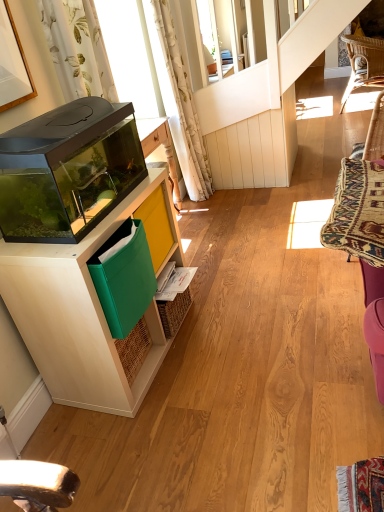
What do you see at coordinates (68, 170) in the screenshot?
I see `transparent glass aquarium at left` at bounding box center [68, 170].

What is the approximate height of white floral fabric curtain at upper center, the 1th curtain viewed from the back?

white floral fabric curtain at upper center, the 1th curtain viewed from the back, is 4.78 feet in height.

At what (x,y) coordinates should I click in order to perform the action: click on green fabric folder at lower left. Please return your answer as a coordinate pair (x, y). The width and height of the screenshot is (384, 512). Looking at the image, I should click on (156, 225).

Image resolution: width=384 pixels, height=512 pixels. Find the location of `white floral fabric curtain at upper left, placed as the 2th curtain when sorted from right to left`. white floral fabric curtain at upper left, placed as the 2th curtain when sorted from right to left is located at coordinates (72, 47).

Identify the location of cabinetry on the right of white floral fabric curtain at upper left, placed as the 2th curtain when sorted from right to left. This screenshot has width=384, height=512. (84, 310).

Considering the relative sizes of white wood cabinet at left and white floral fabric curtain at upper left, which is counted as the 2th curtain, starting from the back, in the image provided, is white wood cabinet at left smaller than white floral fabric curtain at upper left, which is counted as the 2th curtain, starting from the back,?

No, white wood cabinet at left is not smaller than white floral fabric curtain at upper left, which is counted as the 2th curtain, starting from the back.

Which point is more distant from viewer, (36, 360) or (160, 21)?

Point (160, 21)

In the scene shown: Considering the relative positions of woven wicker swivel chair at right and woven rattan chair at upper right in the image provided, is woven wicker swivel chair at right to the left of woven rattan chair at upper right from the viewer's perspective?

Yes.

Is woven wicker swivel chair at right oriented towards woven rattan chair at upper right?

Yes, woven wicker swivel chair at right is aimed at woven rattan chair at upper right.

Which object is further away from the camera, woven wicker swivel chair at right or woven rattan chair at upper right?

woven rattan chair at upper right is more distant.

From the image's perspective, is woven wicker swivel chair at right positioned above or below woven rattan chair at upper right?

woven wicker swivel chair at right is below woven rattan chair at upper right.

Considering the positions of objects woven rattan chair at upper right and woven wicker swivel chair at right in the image provided, who is more to the left, woven rattan chair at upper right or woven wicker swivel chair at right?

Positioned to the left is woven wicker swivel chair at right.

Between woven rattan chair at upper right and woven wicker swivel chair at right, which one has larger width?

woven wicker swivel chair at right.

In the scene shown: From a real-world perspective, is woven rattan chair at upper right positioned over woven wicker swivel chair at right based on gravity?

No, from a real-world perspective, woven rattan chair at upper right is not on top of woven wicker swivel chair at right.

Is white floral fabric curtain at upper left, which is the 1th curtain in front-to-back order, positioned beyond the bounds of woven wicker swivel chair at right?

white floral fabric curtain at upper left, which is the 1th curtain in front-to-back order, is positioned outside woven wicker swivel chair at right.

Which is behind, white floral fabric curtain at upper left, arranged as the 1th curtain when viewed from the left, or woven wicker swivel chair at right?

woven wicker swivel chair at right is further from the camera.

Considering the points (67, 6) and (341, 178), which point is in front, point (67, 6) or point (341, 178)?

The point (341, 178) is more forward.

Based on the photo, who is bigger, white floral fabric curtain at upper left, arranged as the 1th curtain when viewed from the left, or woven wicker swivel chair at right?

With larger size is woven wicker swivel chair at right.

Is transparent glass aquarium at left far away from woven rattan chair at upper right?

Yes, transparent glass aquarium at left and woven rattan chair at upper right are quite far apart.

Is point (95, 206) closer or farther from the camera than point (378, 81)?

Clearly, point (95, 206) is closer to the camera than point (378, 81).

Considering the sizes of transparent glass aquarium at left and woven rattan chair at upper right in the image, is transparent glass aquarium at left wider or thinner than woven rattan chair at upper right?

Considering their sizes, transparent glass aquarium at left looks slimmer than woven rattan chair at upper right.

How different are the orientations of green fabric folder at lower left and white floral fabric curtain at upper left, which is the 1th curtain in front-to-back order, in degrees?

2.95 degrees separate the facing orientations of green fabric folder at lower left and white floral fabric curtain at upper left, which is the 1th curtain in front-to-back order.

Does green fabric folder at lower left have a smaller size compared to white floral fabric curtain at upper left, which is the 1th curtain in front-to-back order?

Indeed, green fabric folder at lower left has a smaller size compared to white floral fabric curtain at upper left, which is the 1th curtain in front-to-back order.

Locate an element on the screen. shelf below the white floral fabric curtain at upper left, placed as the 2th curtain when sorted from right to left (from a real-world perspective) is located at coordinates (156, 225).

From the image's perspective, does green fabric folder at lower left appear higher than white floral fabric curtain at upper left, which is counted as the 2th curtain, starting from the back?

Actually, green fabric folder at lower left appears below white floral fabric curtain at upper left, which is counted as the 2th curtain, starting from the back, in the image.

Considering the sizes of objects green fabric folder at lower left and white floral fabric curtain at upper center, arranged as the second curtain when viewed from the left, in the image provided, who is shorter, green fabric folder at lower left or white floral fabric curtain at upper center, arranged as the second curtain when viewed from the left,?

green fabric folder at lower left is shorter.

Is green fabric folder at lower left thinner than white floral fabric curtain at upper center, arranged as the second curtain when viewed from the left?

Correct, the width of green fabric folder at lower left is less than that of white floral fabric curtain at upper center, arranged as the second curtain when viewed from the left.

How different are the orientations of green fabric folder at lower left and white floral fabric curtain at upper center, the 2th curtain in the front-to-back sequence, in degrees?

There is a 2.95-degree angle between the facing directions of green fabric folder at lower left and white floral fabric curtain at upper center, the 2th curtain in the front-to-back sequence.

This screenshot has width=384, height=512. Find the location of `cabinetry in front of the white floral fabric curtain at upper left, which is the 1th curtain in front-to-back order`. cabinetry in front of the white floral fabric curtain at upper left, which is the 1th curtain in front-to-back order is located at coordinates (84, 310).

Locate an element on the screen. This screenshot has width=384, height=512. chair above the woven wicker swivel chair at right (from the image's perspective) is located at coordinates (364, 63).

Based on the photo, from the image, which object appears to be nearer to green fabric folder at lower left, woven rattan chair at upper right or white floral fabric curtain at upper left, which is the 1th curtain in front-to-back order?

The object closer to green fabric folder at lower left is white floral fabric curtain at upper left, which is the 1th curtain in front-to-back order.

From the image, which object appears to be farther from green fabric folder at lower left, white floral fabric curtain at upper left, which is the 1th curtain in front-to-back order, or woven rattan chair at upper right?

woven rattan chair at upper right lies further to green fabric folder at lower left than the other object.

When comparing their distances from white floral fabric curtain at upper left, which is the 1th curtain in front-to-back order, does white wood cabinet at left or woven wicker swivel chair at right seem closer?

Among the two, white wood cabinet at left is located nearer to white floral fabric curtain at upper left, which is the 1th curtain in front-to-back order.

Which object lies further to the anchor point white floral fabric curtain at upper left, which is the 1th curtain in front-to-back order, transparent glass aquarium at left or woven wicker swivel chair at right?

woven wicker swivel chair at right.

Based on their spatial positions, is transparent glass aquarium at left or green fabric folder at lower left further from woven wicker swivel chair at right?

The object further to woven wicker swivel chair at right is transparent glass aquarium at left.

Based on the photo, estimate the real-world distances between objects in this image. Which object is closer to woven wicker swivel chair at right, green fabric folder at lower left or white floral fabric curtain at upper left, which is the 1th curtain in front-to-back order?

green fabric folder at lower left is closer to woven wicker swivel chair at right.

Considering their positions, is white floral fabric curtain at upper left, arranged as the 1th curtain when viewed from the left, positioned closer to woven wicker swivel chair at right than transparent glass aquarium at left?

transparent glass aquarium at left is positioned closer to the anchor woven wicker swivel chair at right.

Consider the image. Estimate the real-world distances between objects in this image. Which object is closer to white floral fabric curtain at upper center, the 2th curtain in the front-to-back sequence, green fabric folder at lower left or woven rattan chair at upper right?

Among the two, green fabric folder at lower left is located nearer to white floral fabric curtain at upper center, the 2th curtain in the front-to-back sequence.

Where is `swivel chair located between green fabric folder at lower left and woven rattan chair at upper right in the depth direction`? swivel chair located between green fabric folder at lower left and woven rattan chair at upper right in the depth direction is located at coordinates tap(359, 200).

Locate an element on the screen. The height and width of the screenshot is (512, 384). curtain between white floral fabric curtain at upper left, which is the 1th curtain in front-to-back order, and woven wicker swivel chair at right from left to right is located at coordinates (183, 97).

The width and height of the screenshot is (384, 512). I want to click on curtain positioned between transparent glass aquarium at left and white floral fabric curtain at upper center, the first curtain viewed from the right, from near to far, so click(x=72, y=47).

This screenshot has width=384, height=512. Find the location of `cabinetry between transparent glass aquarium at left and woven rattan chair at upper right in the front-back direction`. cabinetry between transparent glass aquarium at left and woven rattan chair at upper right in the front-back direction is located at coordinates (84, 310).